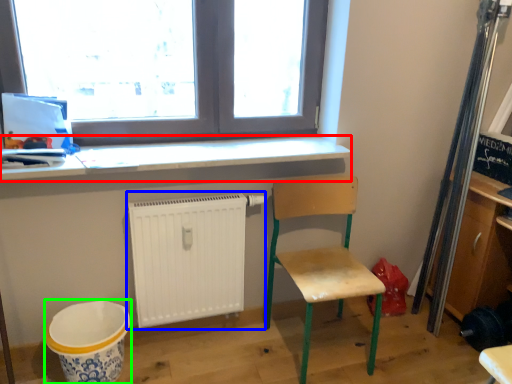
Question: Considering the real-world distances, which object is farthest from counter top (highlighted by a red box)? radiator (highlighted by a blue box) or mixing bowl (highlighted by a green box)?

Choices:
 (A) radiator
 (B) mixing bowl

Answer: (B)